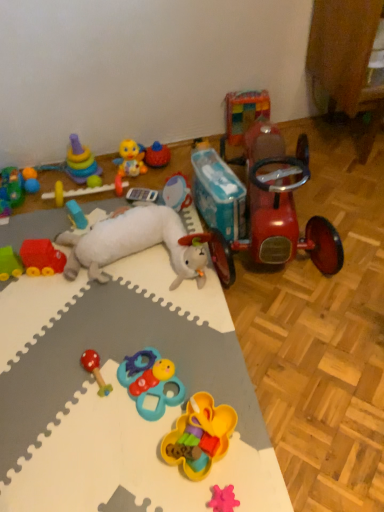
Identify the location of free space in front of wooden/matte rattle at lower left, marked as the 9th toy in a right-to-left arrangement. (92, 437).